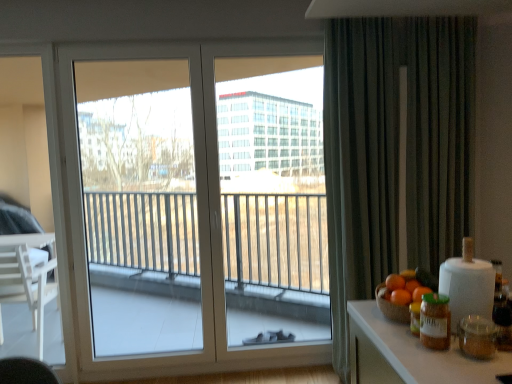
Locate an element on the screen. blank space situated above white glass window at center (from a real-world perspective) is located at coordinates (203, 41).